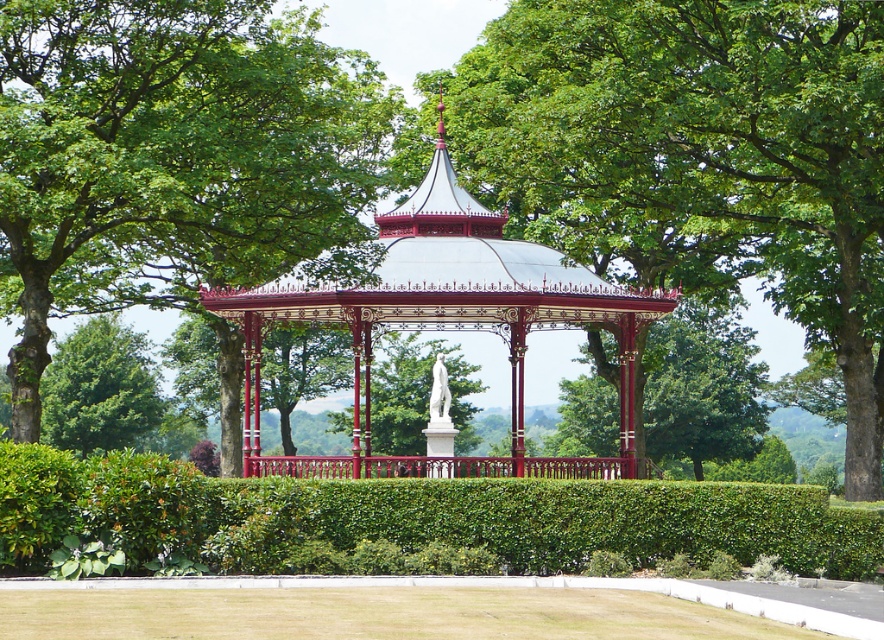
You are standing at the gazebo and want to take a photo of the green leafy tree at center. Where should you position yourself to capture the tree in the frame?

The green leafy tree at center is located at point (698, 157), so you should position yourself facing towards that coordinate to capture it in the frame.

You are standing in the outdoor scene with the gazebo and want to take a photo of the green leafy tree at upper center. Which direction should you face to ensure the tree is in the center of your photo?

The green leafy tree at upper center is located at point coordinates, so you should face the upper center direction to have it centered in your photo.

You are standing at the entrance of the gazebo and want to find the green leafy hedge at center. According to the coordinates provided, in which direction should you look to locate it?

The green leafy hedge at center is located at coordinates point (412, 516), which means it is positioned to the right and slightly above the center of the gazebo. Therefore, you should look towards the right and slightly upward from the center to locate it.